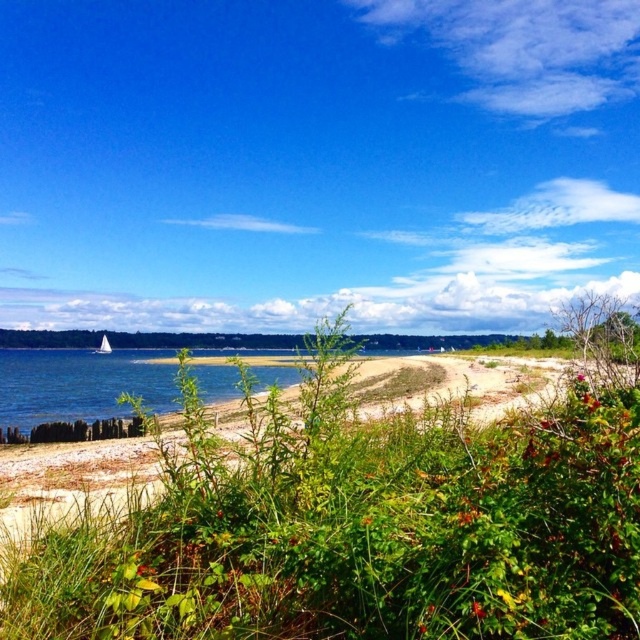
You are standing on the beach and want to take a photo of the white sailboat at left without the green leafy shrubs at center blocking the view. Which direction should you move to ensure the shrubs are out of the frame?

You should move to the right side of the beach because the green leafy shrubs at center are taller than the white sailboat at left, so moving right would position the shrubs behind the boat or out of the frame.

You are a photographer trying to capture a wide shot of the white sailboat at left without including the green leafy shrubs at center. Based on their positions and sizes, is this possible?

The green leafy shrubs at center might be wider than white sailboat at left, making it challenging to frame the shot without including them. Adjust your position or zoom to exclude the shrubs if possible.

You are standing on the beach and want to take a photo of both the green leafy shrubs at center and the white sailboat at left. Which object should you focus on first to ensure both are in focus?

You should focus on the green leafy shrubs at center first because it is closer to the viewer than the white sailboat at left, so adjusting focus starting from the closer object will help capture both in focus.